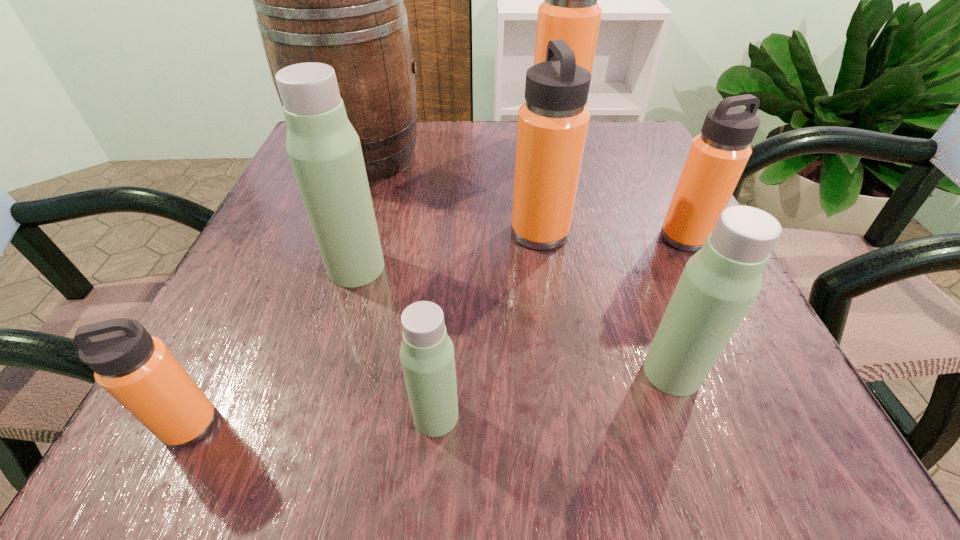
What are the coordinates of `vacant space that satisfies the following two spatial constraints: 1. on the front side of the second smallest light thermos bottle; 2. on the right side of the third smallest orange thermos bottle` in the screenshot? It's located at [x=561, y=372].

Find the location of a particular element. The height and width of the screenshot is (540, 960). free region that satisfies the following two spatial constraints: 1. on the back side of the smallest light thermos bottle; 2. on the right side of the third smallest orange thermos bottle is located at coordinates (450, 233).